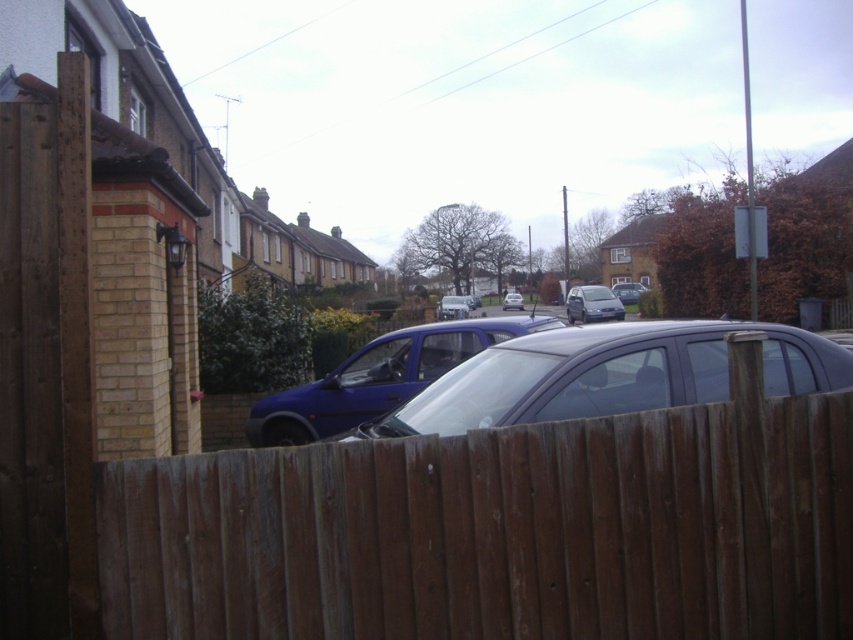
Is point (544, 348) farther from viewer compared to point (364, 403)?

No, it is in front of (364, 403).

Where is `matte black car at center`? This screenshot has width=853, height=640. matte black car at center is located at coordinates (608, 374).

Is point (469, 380) positioned behind point (442, 323)?

That is False.

The height and width of the screenshot is (640, 853). In order to click on matte black car at center in this screenshot , I will do `click(608, 374)`.

Between satin silver hatchback at center and blue metallic van at center, which one appears on the left side from the viewer's perspective?

Positioned to the left is blue metallic van at center.

Can you confirm if satin silver hatchback at center is positioned below blue metallic van at center?

Correct, satin silver hatchback at center is located below blue metallic van at center.

Who is more distant from viewer, (602, 294) or (451, 301)?

The point (451, 301) is more distant.

Where is `satin silver hatchback at center`? satin silver hatchback at center is located at coordinates (592, 305).

Which is more to the right, matte black car at center or blue metallic van at center?

From the viewer's perspective, blue metallic van at center appears more on the right side.

Is matte black car at center thinner than blue metallic van at center?

In fact, matte black car at center might be wider than blue metallic van at center.

Which is behind, point (795, 385) or point (453, 298)?

Positioned behind is point (453, 298).

At what (x,y) coordinates should I click in order to perform the action: click on matte black car at center. Please return your answer as a coordinate pair (x, y). The width and height of the screenshot is (853, 640). Looking at the image, I should click on (608, 374).